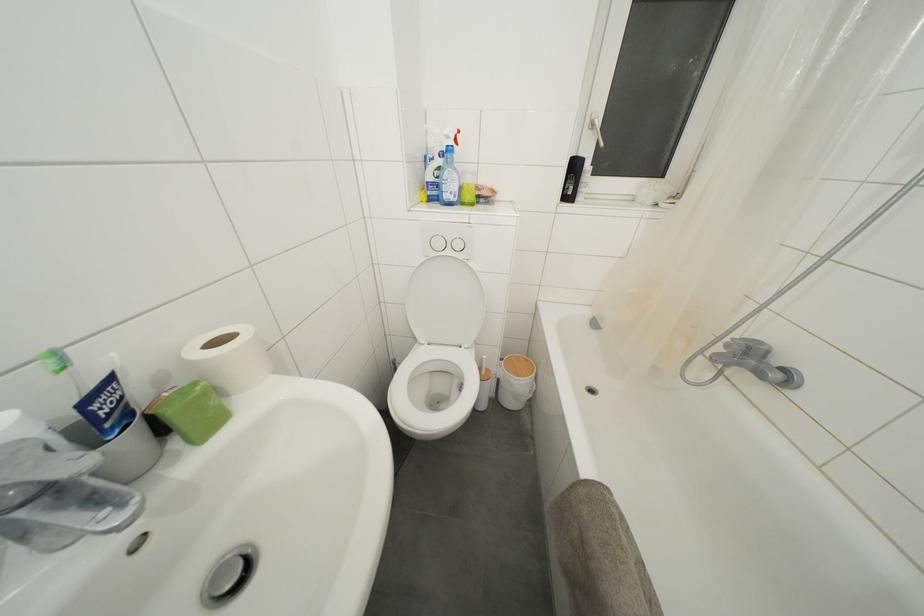
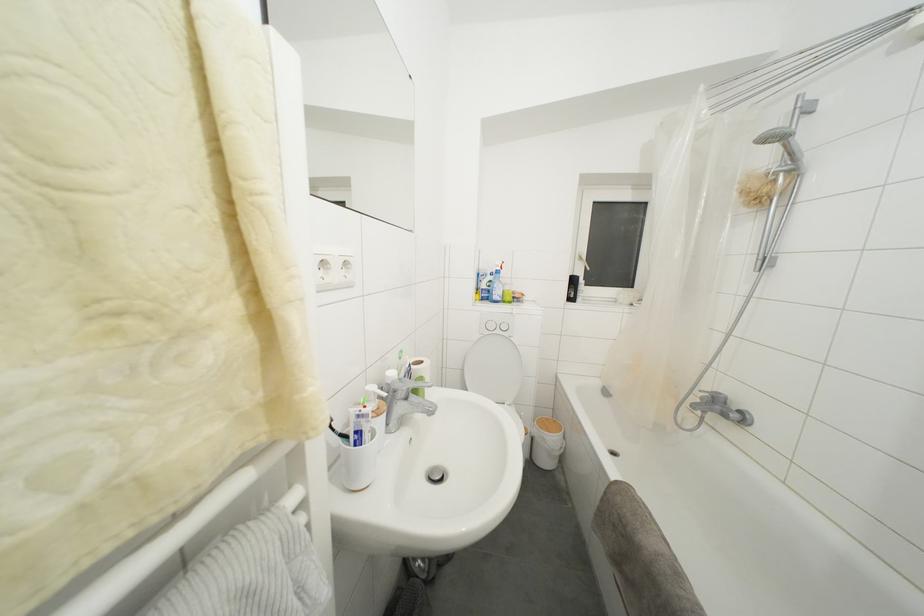
Where in the second image is the point corresponding to [488,204] from the first image?

(520, 304)